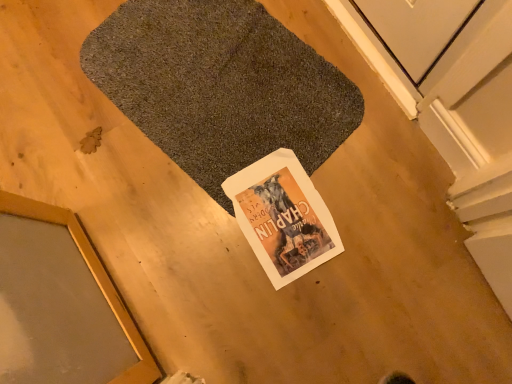
This screenshot has height=384, width=512. What are the coordinates of `free space that is in between white paper magazine at center and dark gray carpet at center` in the screenshot? It's located at (283, 178).